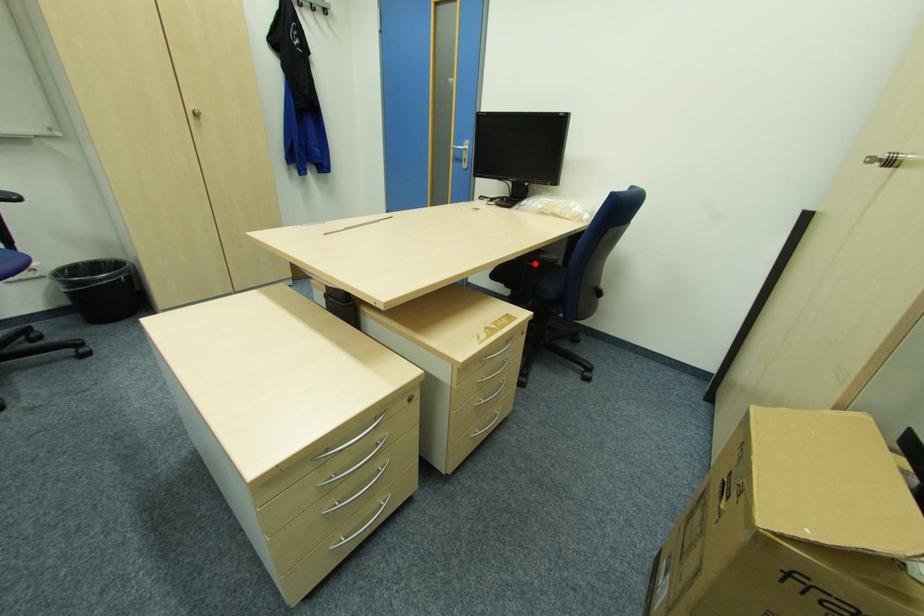
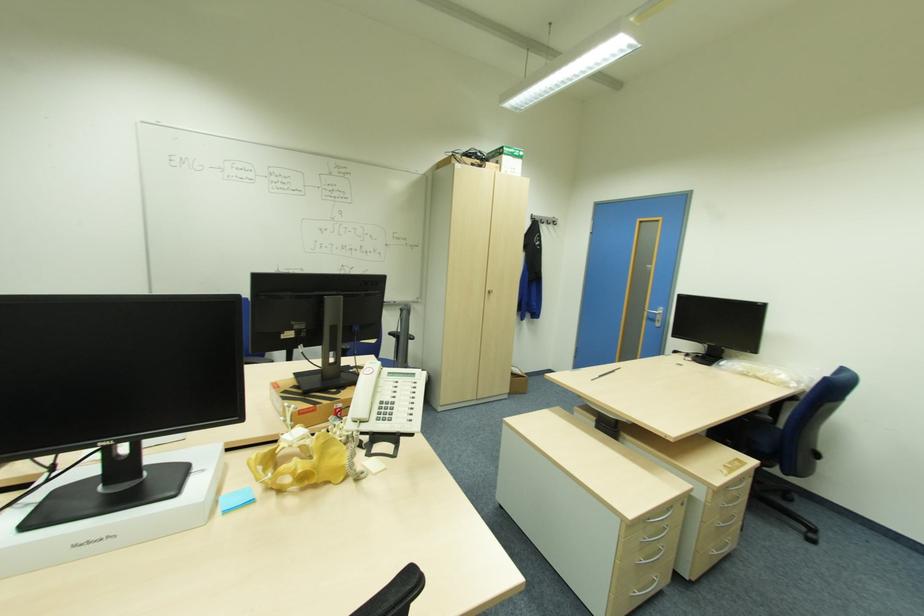
Where in the second image is the point corresponding to the highlighted location from the first image?

(750, 419)